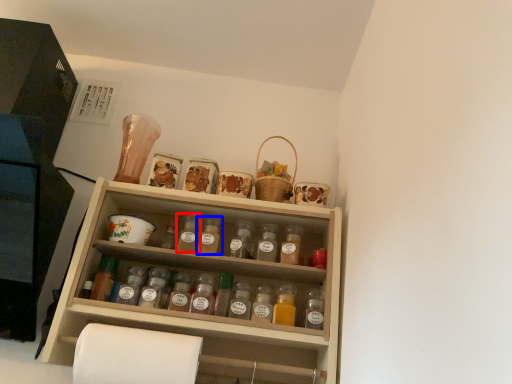
Question: Among these objects, which one is farthest to the camera, bottle (highlighted by a red box) or bottle (highlighted by a blue box)?

Choices:
 (A) bottle
 (B) bottle

Answer: (A)